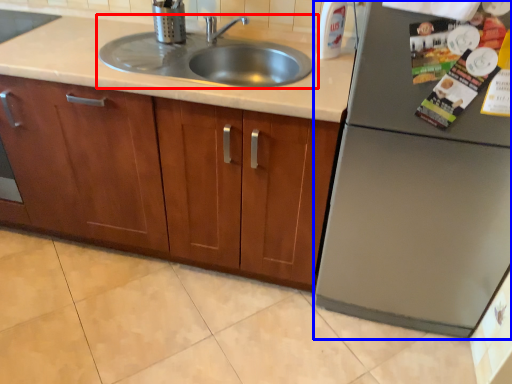
Question: Which point is closer to the camera, sink (highlighted by a red box) or appliance (highlighted by a blue box)?

Choices:
 (A) sink
 (B) appliance

Answer: (B)